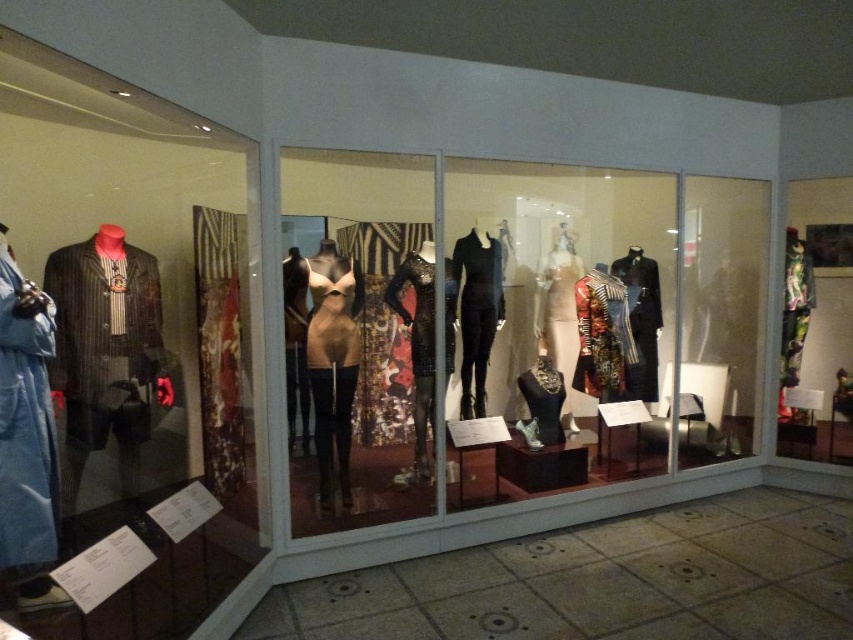
You are a visitor standing in front of the museum display case. You see the matte beige dress at center and the shiny metallic dress at center. Which dress is closer to you?

The matte beige dress at center is closer to you because it is positioned further to the viewer than the shiny metallic dress at center.

You are standing in front of the museum display case. You want to take a photo of the point at coordinates point (537, 304). The camera you have can focus on objects up to 20 feet away. Will the point be in focus?

The distance of point (537, 304) from viewer is 17.83 feet, which is within the camera focus range of 20 feet. Therefore, the point will be in focus.